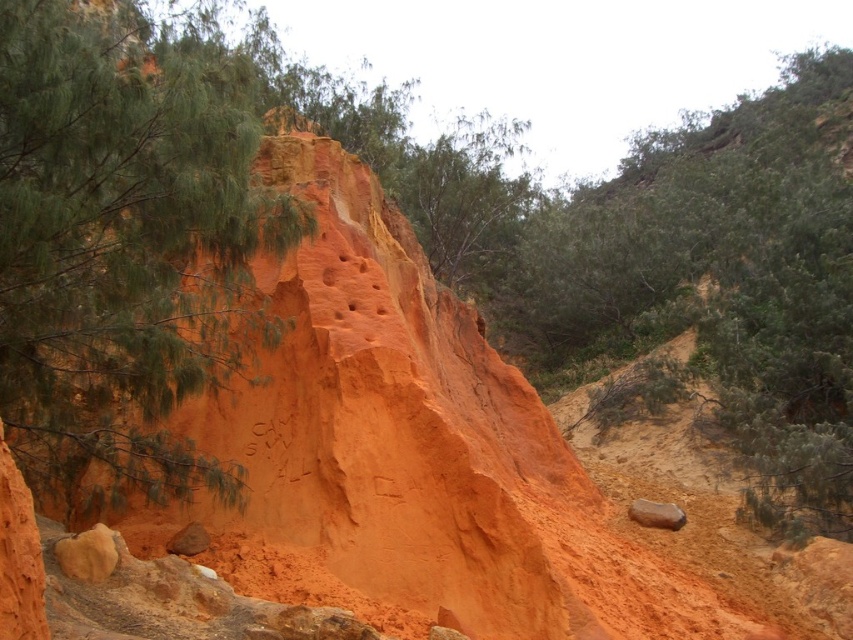
Which of these two, green leafy tree at upper left or green leafy tree at upper center, stands shorter?

With less height is green leafy tree at upper left.

Who is more distant from viewer, (0, 148) or (743, 307)?

The point (743, 307) is behind.

Identify the location of green leafy tree at upper left. The width and height of the screenshot is (853, 640). (125, 241).

Where is `green leafy tree at upper left`? Image resolution: width=853 pixels, height=640 pixels. green leafy tree at upper left is located at coordinates (125, 241).

Between point (595, 196) and point (679, 512), which one is positioned in front?

Point (679, 512) is more forward.

Can you confirm if green leafy tree at upper center is taller than smooth brown rock at lower right?

Correct, green leafy tree at upper center is much taller as smooth brown rock at lower right.

In order to click on green leafy tree at upper center in this screenshot , I will do `click(723, 276)`.

Between green leafy tree at upper left and smooth brown rock at lower right, which one is positioned lower?

smooth brown rock at lower right

Is green leafy tree at upper left further to the viewer compared to smooth brown rock at lower right?

That is False.

Who is more forward, (x=51, y=96) or (x=674, y=524)?

Point (x=51, y=96) is more forward.

The width and height of the screenshot is (853, 640). Identify the location of green leafy tree at upper left. (125, 241).